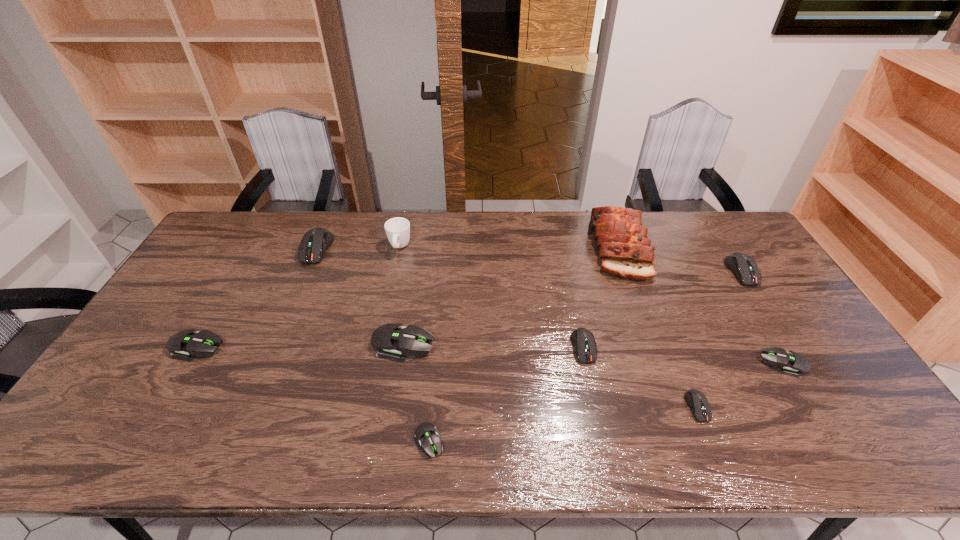
The image size is (960, 540). Identify the location of the tallest object. (624, 250).

Locate an element on the screen. the second tallest object is located at coordinates (397, 229).

You are a GUI agent. You are given a task and a screenshot of the screen. Output one action in this format:
    pyautogui.click(x=<x>, y=<y>)
    Task: Click on the third tallest object
    
    Given the screenshot: What is the action you would take?
    pyautogui.click(x=315, y=242)

What are the coordinates of `the tallest computer mouse` in the screenshot? It's located at (315, 242).

The image size is (960, 540). Find the location of `the rightmost dark computer equipment`. the rightmost dark computer equipment is located at coordinates (745, 269).

You are a GUI agent. You are given a task and a screenshot of the screen. Output one action in this format:
    pyautogui.click(x=<x>, y=<y>)
    Task: Click on the biggest gray computer mouse
    
    Given the screenshot: What is the action you would take?
    pyautogui.click(x=390, y=341)

I want to click on the fifth object from right to left, so click(x=583, y=340).

Find the location of a particular element. the fourth computer mouse from right to left is located at coordinates (583, 340).

Where is `the leftmost computer mouse`? The height and width of the screenshot is (540, 960). the leftmost computer mouse is located at coordinates (192, 343).

Identify the location of the leftmost object. (192, 343).